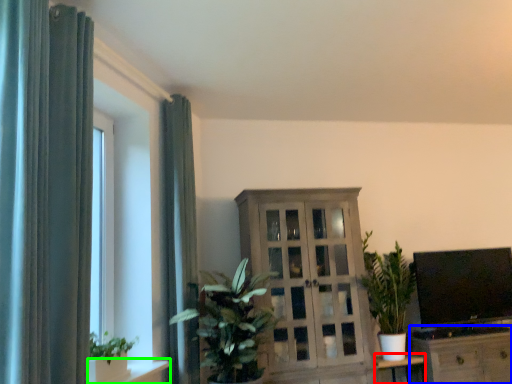
Question: Based on their relative distances, which object is nearer to table (highlighted by a red box)? Choose from cabinetry (highlighted by a blue box) and shelf (highlighted by a green box).

Choices:
 (A) cabinetry
 (B) shelf

Answer: (A)